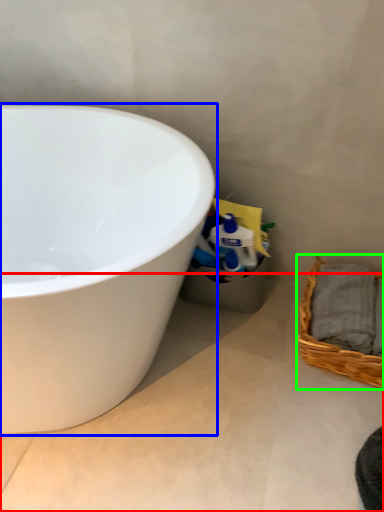
Question: Considering the real-world distances, which object is farthest from concrete (highlighted by a red box)? bathtub (highlighted by a blue box) or picnic basket (highlighted by a green box)?

Choices:
 (A) bathtub
 (B) picnic basket

Answer: (A)